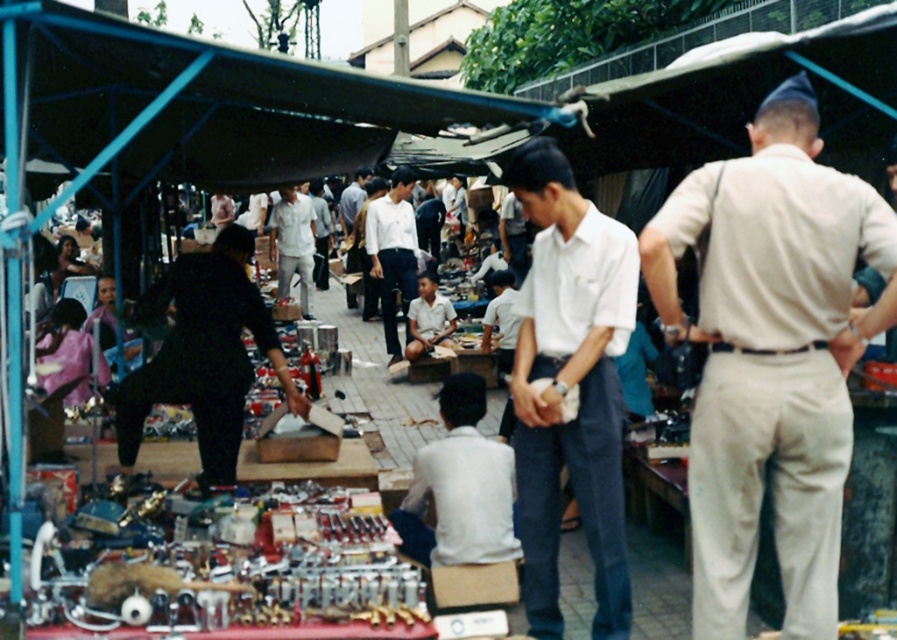
You are standing at the entrance of the market and see the white cotton shirt at center. If you want to buy it, which direction should you walk relative to your current position?

The white cotton shirt at center is located at point (x=570, y=387), so you should walk towards the center of the market to reach it.